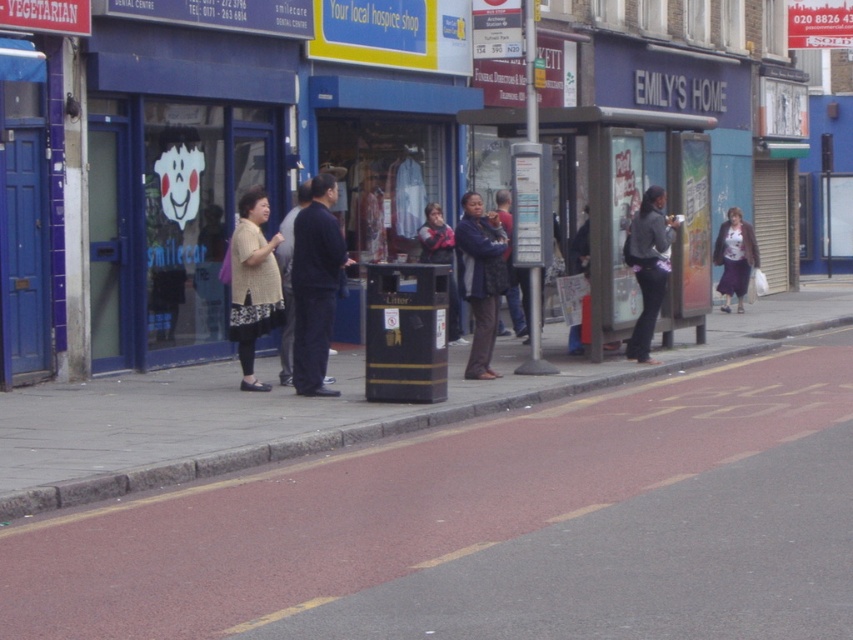
Is matte purple skirt at right below dark blue jacket at center?

Actually, matte purple skirt at right is above dark blue jacket at center.

Can you confirm if matte purple skirt at right is shorter than dark blue jacket at center?

Incorrect, matte purple skirt at right's height does not fall short of dark blue jacket at center's.

Identify the location of matte purple skirt at right. Image resolution: width=853 pixels, height=640 pixels. (734, 257).

Does point (67, 412) come behind point (647, 273)?

No.

Is point (346, 429) behind point (633, 339)?

No, it is not.

This screenshot has width=853, height=640. In order to click on concrete sidewalk at lower left in this screenshot , I will do tap(410, 412).

The image size is (853, 640). Describe the element at coordinates (631, 208) in the screenshot. I see `metallic bus stop at center` at that location.

Which is more to the right, metallic bus stop at center or matte purple skirt at right?

matte purple skirt at right is more to the right.

This screenshot has height=640, width=853. What are the coordinates of `metallic bus stop at center` in the screenshot? It's located at (631, 208).